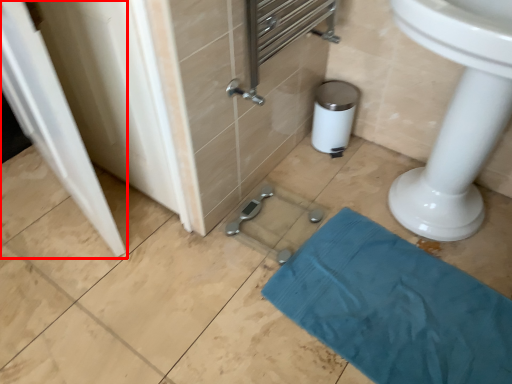
Question: From the image, what is the correct spatial relationship of screen door (annotated by the red box) in relation to bath towel?

Choices:
 (A) left
 (B) right

Answer: (A)